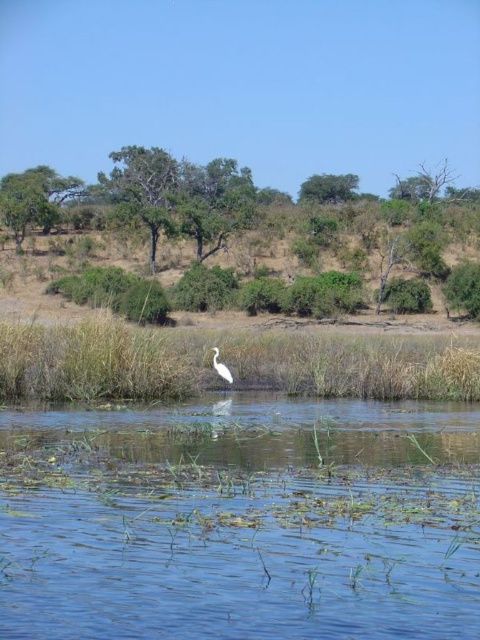
You are an artist sketching the landscape and want to ensure the green leafy tree at upper left and the green leafy tree at upper center are proportionally accurate. Which tree should you draw smaller to maintain the scene?

The green leafy tree at upper left should be drawn smaller than the green leafy tree at upper center to maintain the scene as it occupies less space.

You are a photographer trying to capture the clear blue water at center and the white glossy bird at center in a single shot. Based on their positions, which object will appear closer to the camera in the photo?

The white glossy bird at center appears closer to the camera because it has a greater height than the clear blue water at center.

You are a photographer trying to capture the white glossy bird at center and the clear blue water at center in the same frame. Based on their positions, which object is located to the right of the other?

The clear blue water at center is positioned on the right side of white glossy bird at center, so the clear blue water at center is to the right of the white glossy bird at center.